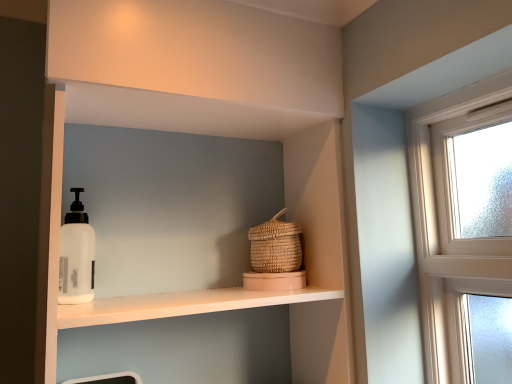
Question: Considering the relative positions of white matte shelf at center and woven straw basket at center in the image provided, is white matte shelf at center in front of woven straw basket at center?

Choices:
 (A) yes
 (B) no

Answer: (A)

Question: From a real-world perspective, is white matte shelf at center below woven straw basket at center?

Choices:
 (A) no
 (B) yes

Answer: (B)

Question: Considering the relative sizes of white matte shelf at center and woven straw basket at center in the image provided, is white matte shelf at center bigger than woven straw basket at center?

Choices:
 (A) yes
 (B) no

Answer: (A)

Question: Is white matte shelf at center not inside woven straw basket at center?

Choices:
 (A) yes
 (B) no

Answer: (A)

Question: Is there a large distance between white matte shelf at center and woven straw basket at center?

Choices:
 (A) yes
 (B) no

Answer: (B)

Question: Is white matte shelf at center at the left side of woven straw basket at center?

Choices:
 (A) no
 (B) yes

Answer: (B)

Question: Does woven straw basket at center have a greater height compared to white matte shelf at center?

Choices:
 (A) no
 (B) yes

Answer: (A)

Question: Is woven straw basket at center to the left of white matte shelf at center from the viewer's perspective?

Choices:
 (A) yes
 (B) no

Answer: (B)

Question: Could you tell me if woven straw basket at center is turned towards white matte shelf at center?

Choices:
 (A) yes
 (B) no

Answer: (A)

Question: From the image's perspective, does woven straw basket at center appear lower than white matte shelf at center?

Choices:
 (A) yes
 (B) no

Answer: (B)

Question: Is woven straw basket at center turned away from white matte shelf at center?

Choices:
 (A) yes
 (B) no

Answer: (A)

Question: Can you confirm if woven straw basket at center is wider than white matte shelf at center?

Choices:
 (A) no
 (B) yes

Answer: (A)

Question: Is woven straw basket at center spatially inside white matte shelf at center, or outside of it?

Choices:
 (A) inside
 (B) outside

Answer: (A)